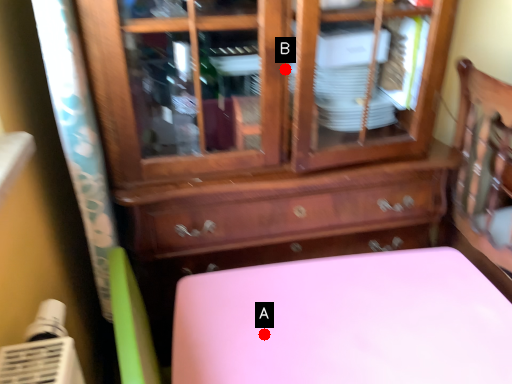
Question: Two points are circled on the image, labeled by A and B beside each circle. Which point is closer to the camera?

Choices:
 (A) A is closer
 (B) B is closer

Answer: (A)